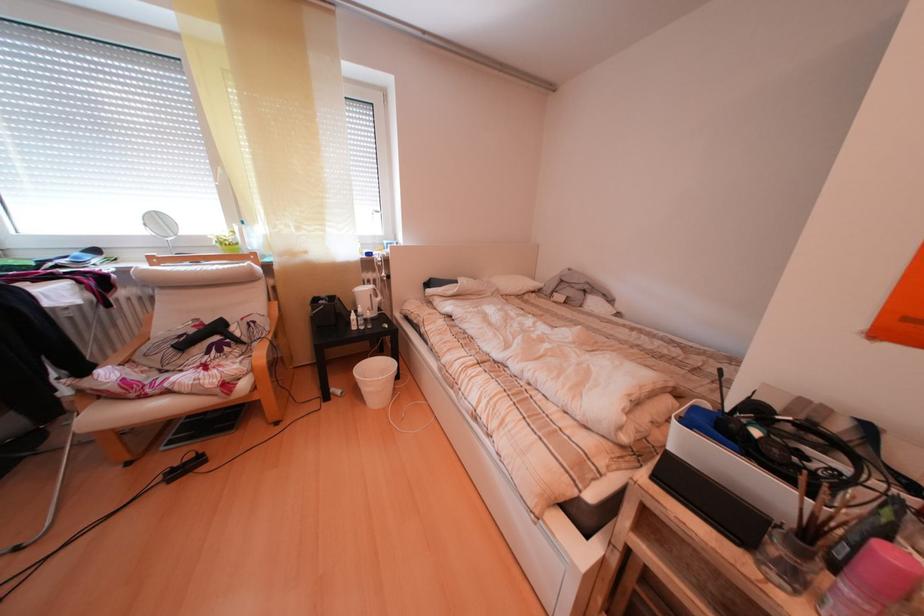
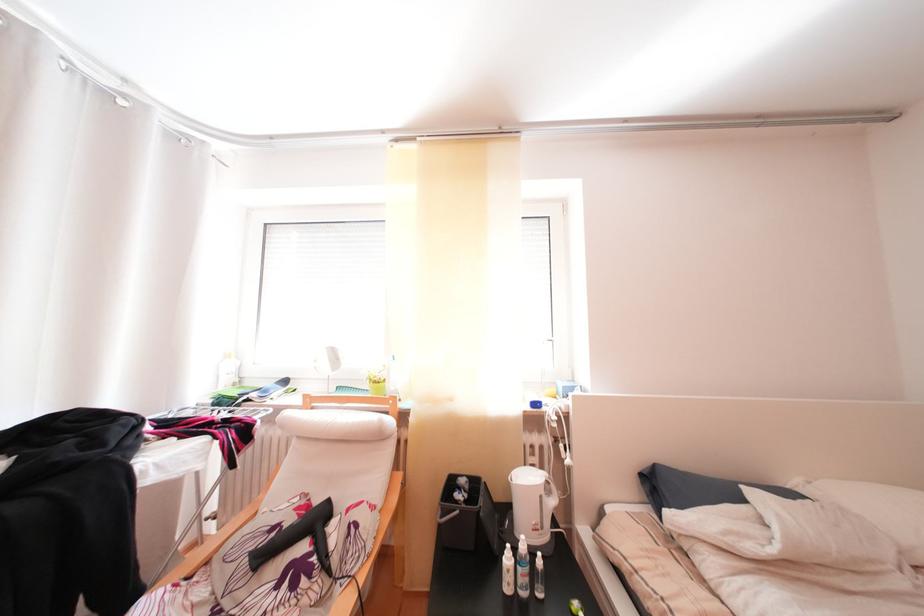
In the second image, find the point that corresponds to pixel 360 328 in the first image.

(509, 565)